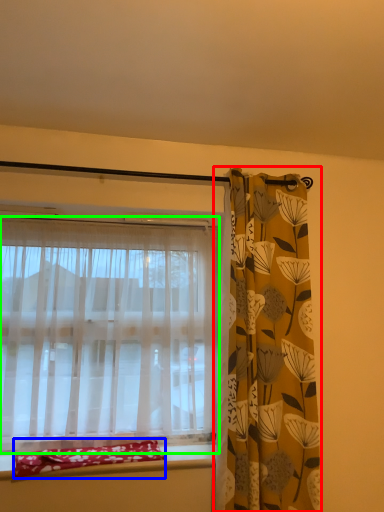
Question: Estimate the real-world distances between objects in this image. Which object is closer to curtain (highlighted by a red box), material (highlighted by a blue box) or curtain (highlighted by a green box)?

Choices:
 (A) material
 (B) curtain

Answer: (B)